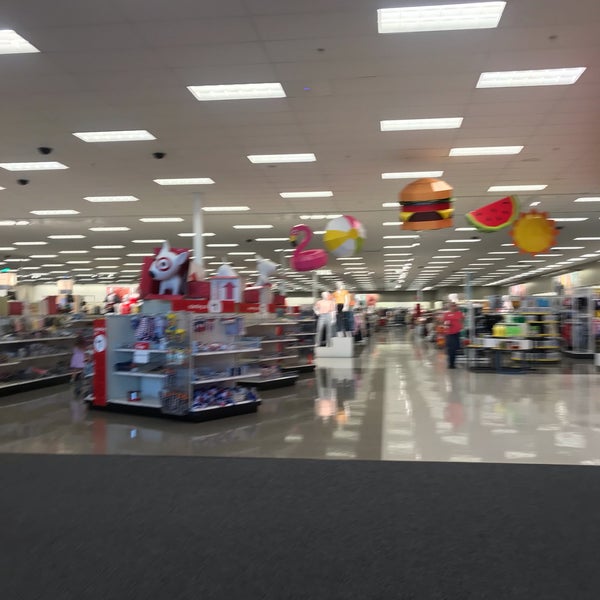
Find the location of a particular element. shelf is located at coordinates (196, 367).